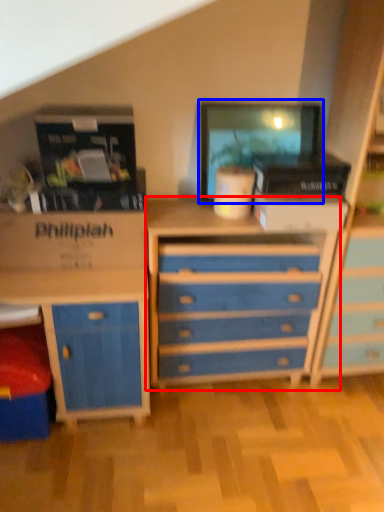
Question: Which object is further to the camera taking this photo, chest of drawers (highlighted by a red box) or computer monitor (highlighted by a blue box)?

Choices:
 (A) chest of drawers
 (B) computer monitor

Answer: (B)